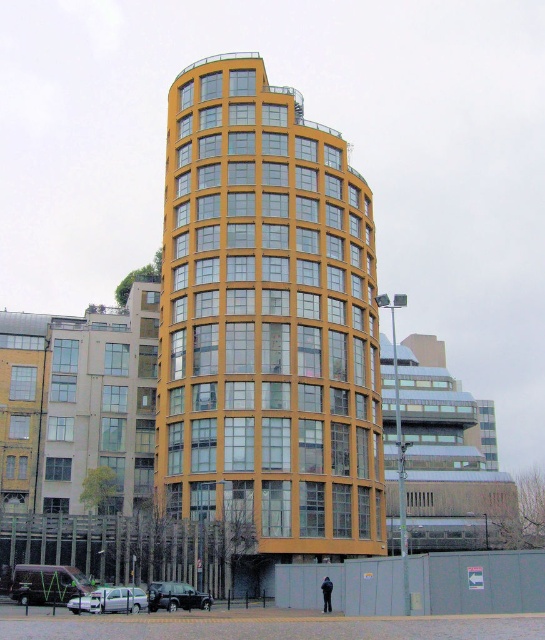
Which is more to the left, yellow glass building at center or dark blue fabric at lower center?

yellow glass building at center is more to the left.

Consider the image. Does yellow glass building at center have a larger size compared to dark blue fabric at lower center?

Correct, yellow glass building at center is larger in size than dark blue fabric at lower center.

Does point (197, 225) lie behind point (329, 604)?

Yes, it is.

The width and height of the screenshot is (545, 640). Identify the location of yellow glass building at center. (267, 321).